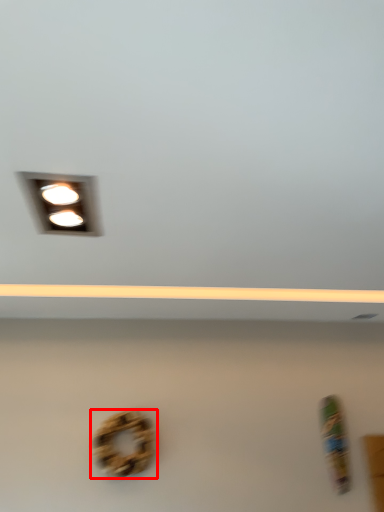
Question: In this image, where is bagel (annotated by the red box) located relative to lamp?

Choices:
 (A) left
 (B) right

Answer: (B)